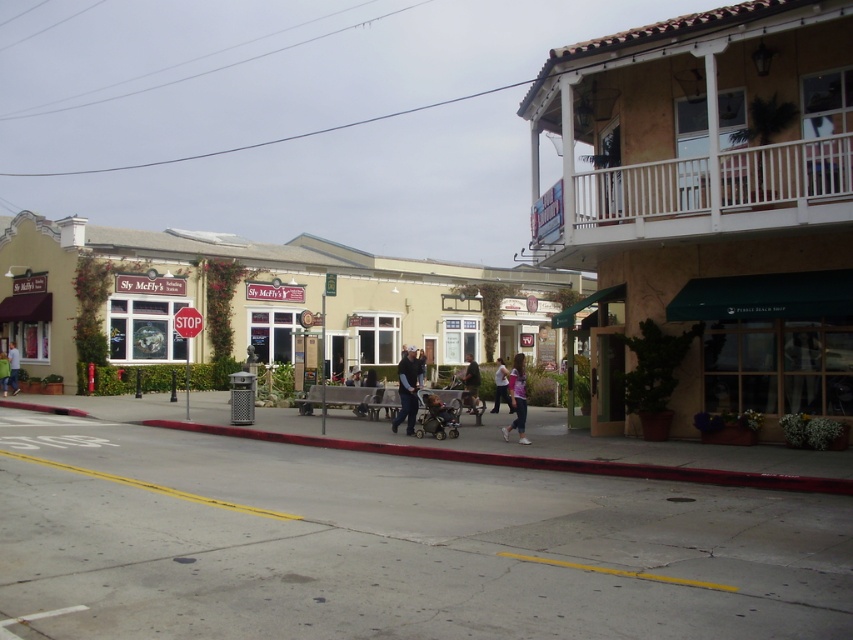
You are a pedestrian standing on the sidewalk next to the red curb. You see the beige stucco building at upper right and the green fabric jacket at center. Which object is taller?

The beige stucco building at upper right is taller than the green fabric jacket at center.

From the picture: You are a pedestrian standing at the edge of the sidewalk near the red curb. You want to cross the street to reach the stop sign. There is a beige stucco building at upper right and a green fabric jacket at center in your view. Which object is closer to your current position?

The green fabric jacket at center is closer to your current position because it is positioned to the left of the beige stucco building at upper right, which is further away.

You are standing at the point marked by the coordinates point (407, 390) in the image. What object are you currently standing on?

You are standing on dark blue jeans at center, which corresponds to the coordinates point (407, 390).